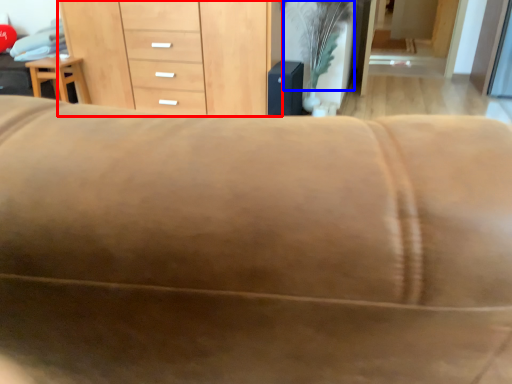
Question: Which object is closer to the camera taking this photo, chest of drawers (highlighted by a red box) or plant (highlighted by a blue box)?

Choices:
 (A) chest of drawers
 (B) plant

Answer: (B)